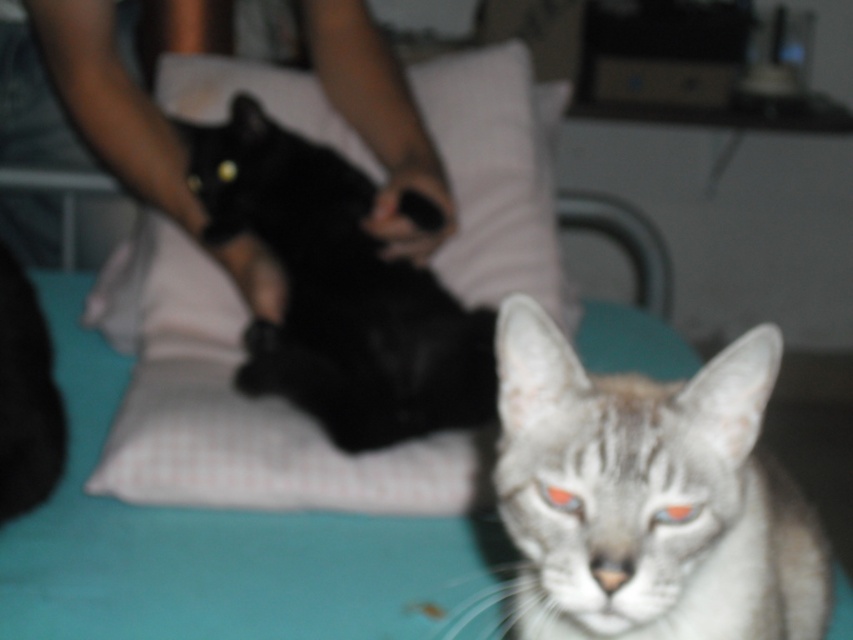
You are a veterinarian examining a cat with two eyes. The cat has a shiny orange eye at center and a shiny blue eye at center. Which eye is taller?

The shiny orange eye at center is much taller than the shiny blue eye at center.

You are a photographer trying to capture a closeup of the shiny blue eye at center. To avoid including the white checkered pillow at upper center in your shot, should you move the camera to the right or left?

The white checkered pillow at upper center is on the left side of the shiny blue eye at center, so to exclude it from the frame, move the camera to the left.